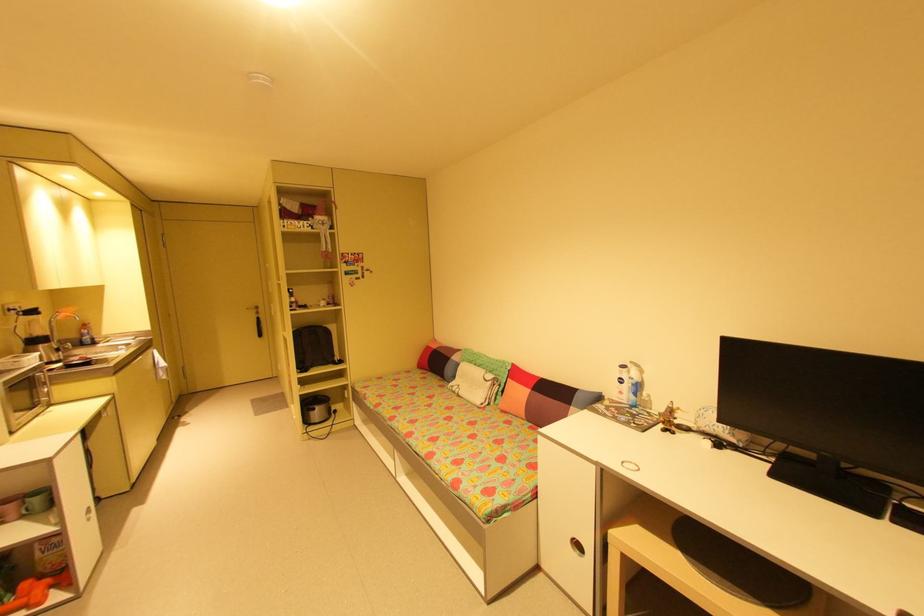
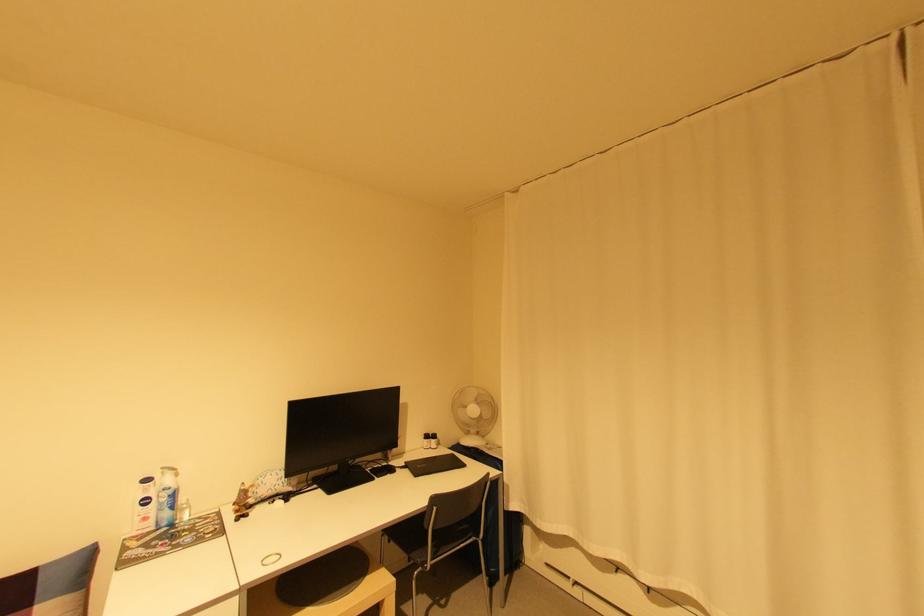
Question: The camera is either moving clockwise (left) or counter-clockwise (right) around the object. The first image is from the beginning of the video and the second image is from the end. Is the camera moving left or right when shooting the video?

Choices:
 (A) Left
 (B) Right

Answer: (A)